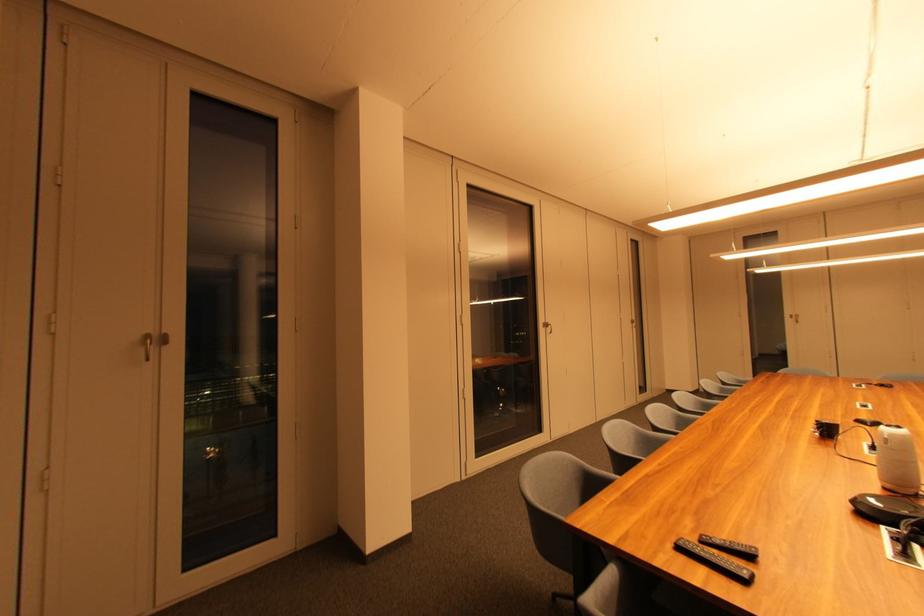
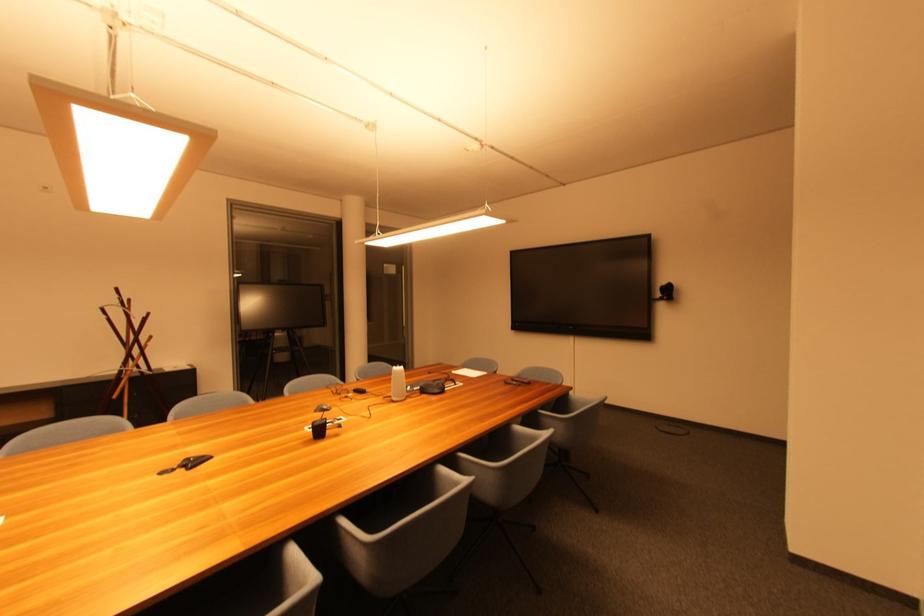
Find the pixel in the second image that matches pixel 833 432 in the first image.

(324, 432)